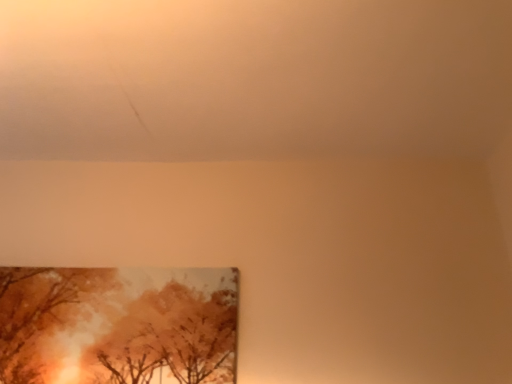
Question: Should I look upward or downward to see matte brown painting at lower left?

Choices:
 (A) down
 (B) up

Answer: (A)